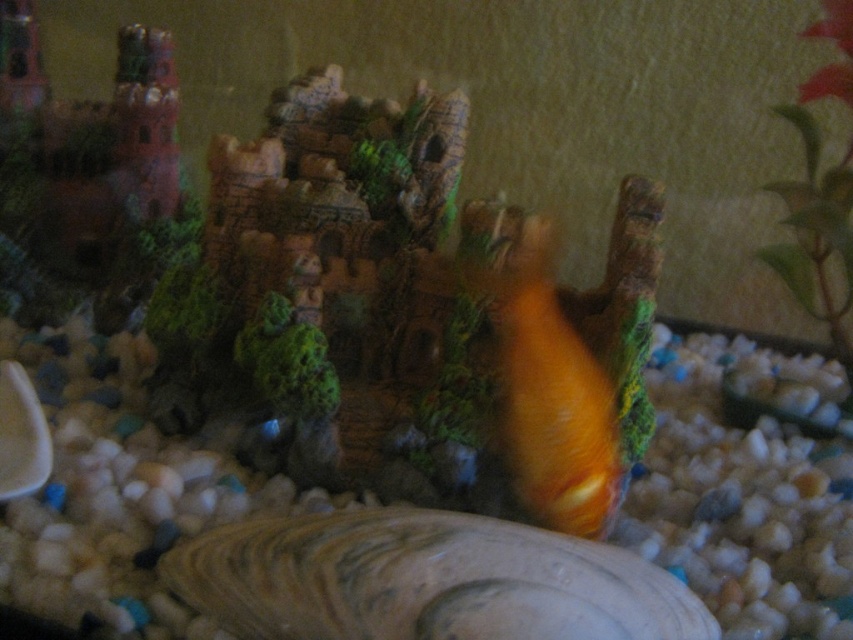
Based on the photo, you are an aquatic creature swimming in the aquarium. You want to reach the green leafy plant at upper right to rest. Is the orange matte goldfish at center blocking your path?

The orange matte goldfish at center is in front of the green leafy plant at upper right, so it is blocking your path to the plant.

You are a robotic arm trying to place a new decorative item in the aquarium scene. The robotic arm can only move in straight lines and needs to avoid hitting the orange matte goldfish at center. What is the safest direction to move the robotic arm without colliding with the goldfish?

The orange matte goldfish at center is located at point (553, 397). To avoid collision, the robotic arm should move in a direction away from this coordinate, such as towards the edges of the scene where there are no other objects obstructing the path.

You are a caretaker of this miniature aquarium scene. You notice the orange matte goldfish at center is swimming towards the castle structure. Can the goldfish reach the castle structure without touching it?

The orange matte goldfish at center and the castle structure are 35.30 inches apart. Since the distance is quite large, the goldfish may not be able to reach the castle structure without touching it, depending on its swimming capability.